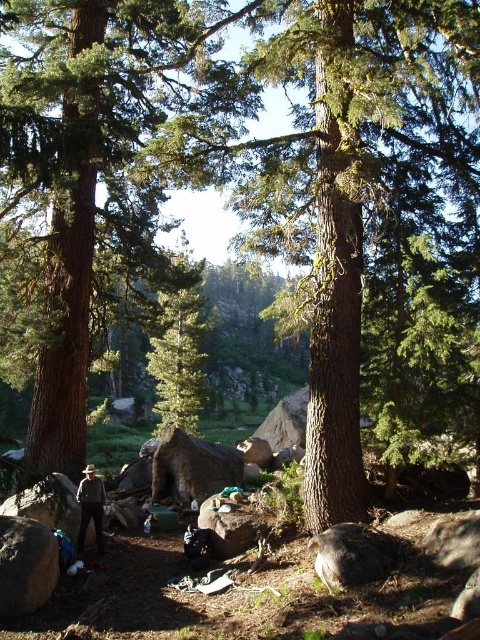
You are a hiker who has just set up camp in this forest. You want to take a photo of the green matte tree at center from a distance where it will appear large in the frame. Considering the tree is 18.92 meters away, would you need to move closer or stay at your current position to achieve this?

The green matte tree at center is currently 18.92 meters away. To make it appear larger in the photo, you should move closer to reduce the distance between you and the tree.